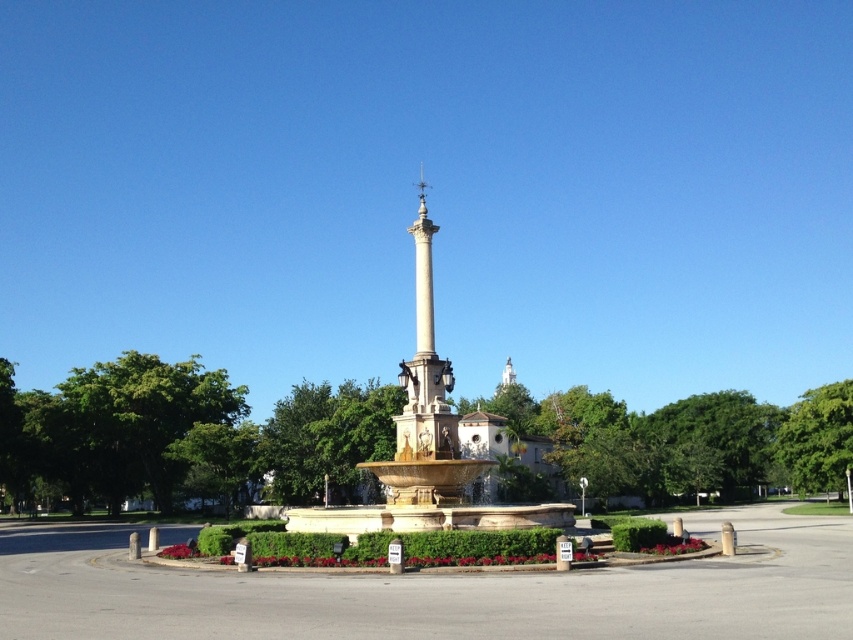
Question: Which point is closer to the camera taking this photo?

Choices:
 (A) (405, 419)
 (B) (427, 476)

Answer: (B)

Question: Is golden stone fountain at center bigger than beige stone column at center?

Choices:
 (A) yes
 (B) no

Answer: (A)

Question: Is golden stone fountain at center to the right of beige stone column at center from the viewer's perspective?

Choices:
 (A) no
 (B) yes

Answer: (A)

Question: Is golden stone fountain at center thinner than beige stone column at center?

Choices:
 (A) no
 (B) yes

Answer: (A)

Question: Among these points, which one is farthest from the camera?

Choices:
 (A) (418, 195)
 (B) (412, 227)

Answer: (A)